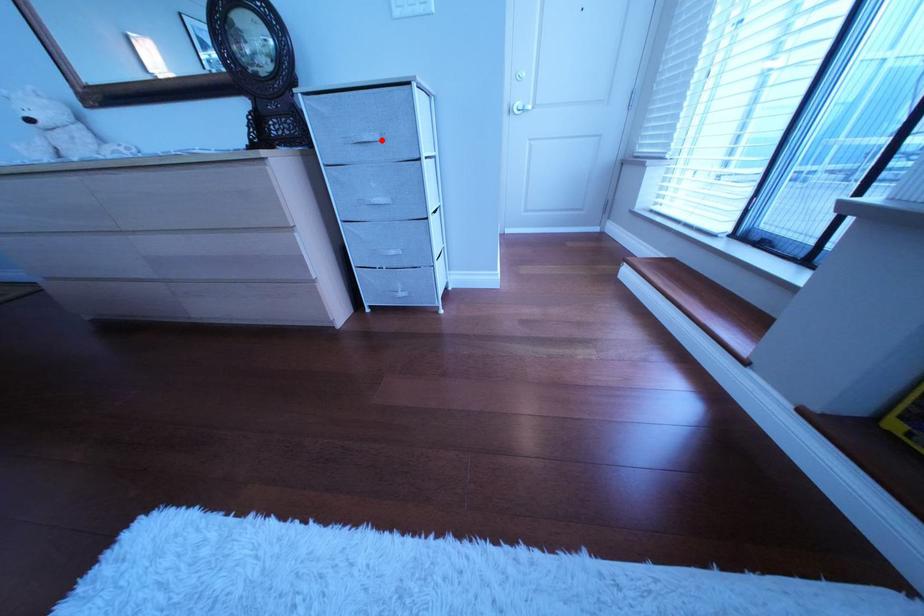
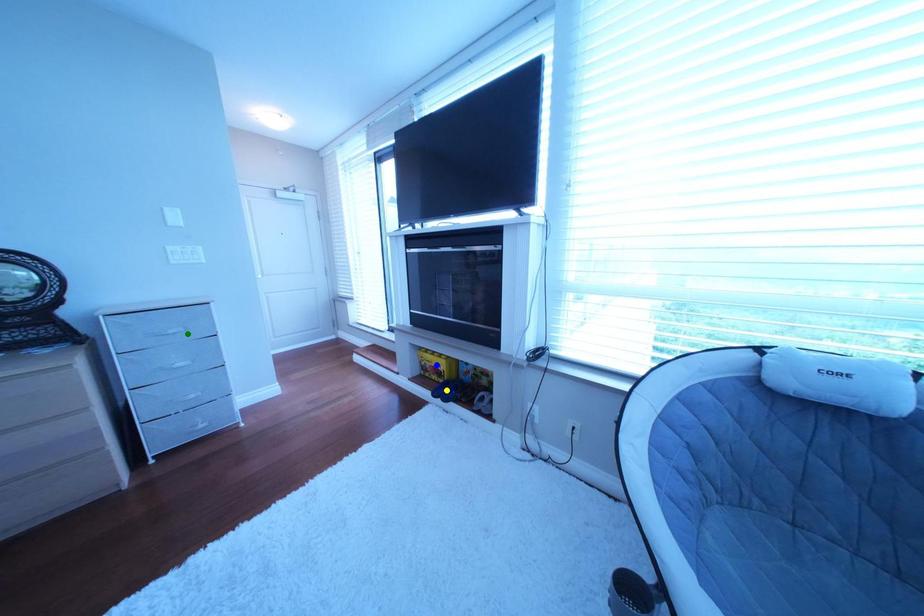
Question: I am providing you with two images of the same scene from different viewpoints. A red point is marked on the first image. You are given multiple points on the second image. Can you choose the point in image 2 that corresponds to the point in image 1?

Choices:
 (A) blue point
 (B) yellow point
 (C) green point

Answer: (C)